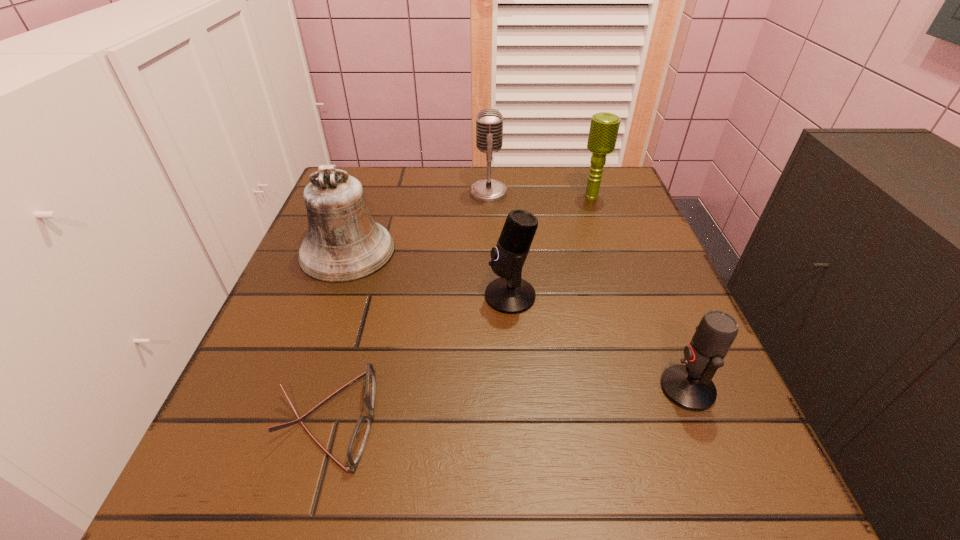
Locate an element on the screen. This screenshot has height=540, width=960. bell is located at coordinates (343, 244).

Find the location of a particular element. the second nearest microphone is located at coordinates (510, 294).

You are a GUI agent. You are given a task and a screenshot of the screen. Output one action in this format:
    pyautogui.click(x=<x>, y=<y>)
    Task: Click on the shortest microphone
    
    Given the screenshot: What is the action you would take?
    pyautogui.click(x=690, y=386)

Identify the location of the nearest microphone. (690, 386).

In order to click on spectacles in this screenshot , I will do `click(358, 440)`.

What are the coordinates of `free space located 0.360m on the front of the bell` in the screenshot? It's located at (271, 465).

At what (x,y) coordinates should I click in order to perform the action: click on free space located 0.090m on the stand of the third farthest microphone. Please return your answer as a coordinate pair (x, y). The height and width of the screenshot is (540, 960). Looking at the image, I should click on (437, 296).

You are a GUI agent. You are given a task and a screenshot of the screen. Output one action in this format:
    pyautogui.click(x=<x>, y=<y>)
    Task: Click on the vacant space situated on the stand of the third farthest microphone
    The width and height of the screenshot is (960, 540).
    Given the screenshot: What is the action you would take?
    pyautogui.click(x=304, y=296)

I want to click on vacant position located 0.290m on the stand of the third farthest microphone, so click(330, 296).

Locate an element on the screen. vacant region located 0.270m on the side of the nearest microphone with the red ring is located at coordinates (486, 389).